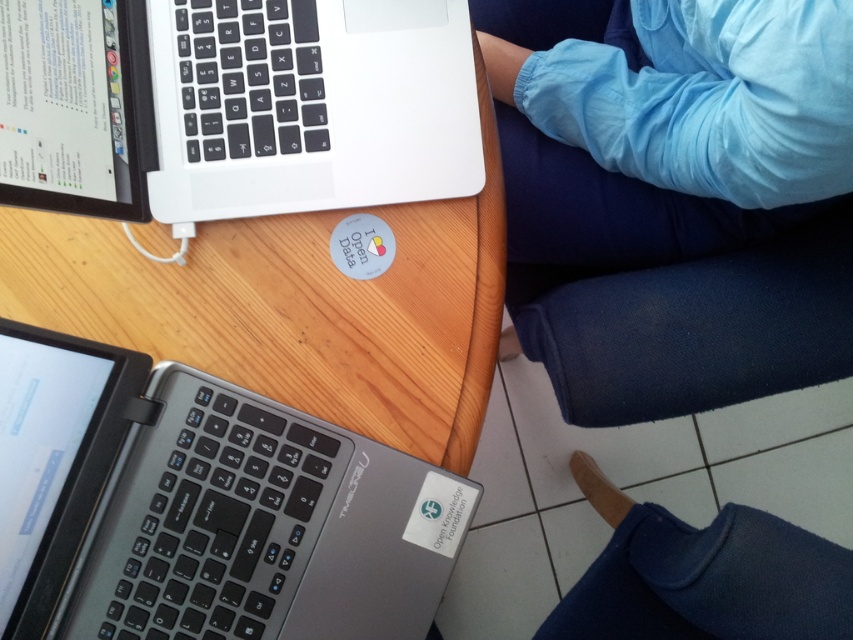
You are a photographer setting up a shoot in this workspace. You need to place a small prop between the blue fabric pants at lower right and the blue fabric leg at lower right. Based on their positions, which object should the prop be closer to if you want it near the taller one?

The prop should be placed closer to the blue fabric pants at lower right because it is taller than the blue fabric leg at lower right.

You are a person with a height of 5 feet 6 inches. You are standing in front of the silver metallic laptop at lower left. Can you comfortably reach the laptop without needing to stretch too much?

The silver metallic laptop at lower left is 19.29 inches away from you, which is a comfortable distance for someone of your height to reach without stretching too much.

You are organizing a tech conference and need to set up a booth. You have a silver metallic laptop at lower left and blue fabric pants at lower right. Which item should you move to the left side of the booth to align with the event theme focusing on open data and transparency?

You should move the blue fabric pants at lower right to the left side of the booth because it has the sticker near it indicating open data, which aligns with the event theme focusing on open data and transparency.